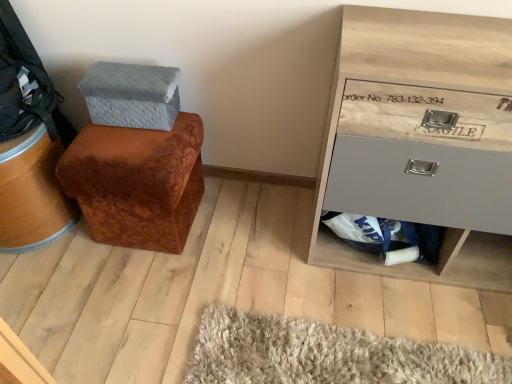
Identify the location of vacant area that is situated to the right of brown velvety ottoman at left. The image size is (512, 384). (240, 225).